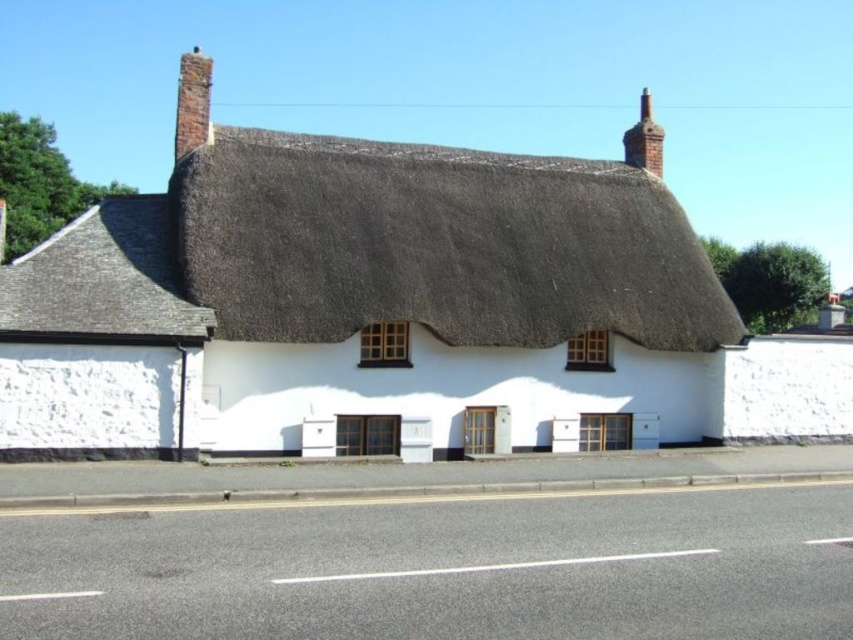
Is brown thatch roof at center to the right of red brick chimney at upper right from the viewer's perspective?

No, brown thatch roof at center is not to the right of red brick chimney at upper right.

Who is shorter, brown thatch roof at center or red brick chimney at upper right?

brown thatch roof at center

The height and width of the screenshot is (640, 853). I want to click on brown thatch roof at center, so 437,244.

Where is `brown thatch roof at center`? The image size is (853, 640). brown thatch roof at center is located at coordinates (437, 244).

Between brown thatch roof at center and brick chimney at upper left, which one has less height?

brown thatch roof at center

Does brown thatch roof at center have a lesser width compared to brick chimney at upper left?

Yes, brown thatch roof at center is thinner than brick chimney at upper left.

Locate an element on the screen. brown thatch roof at center is located at coordinates click(x=437, y=244).

Is white thatched roof cottage at center to the left of brown thatch roof at center from the viewer's perspective?

Correct, you'll find white thatched roof cottage at center to the left of brown thatch roof at center.

This screenshot has width=853, height=640. I want to click on white thatched roof cottage at center, so click(364, 308).